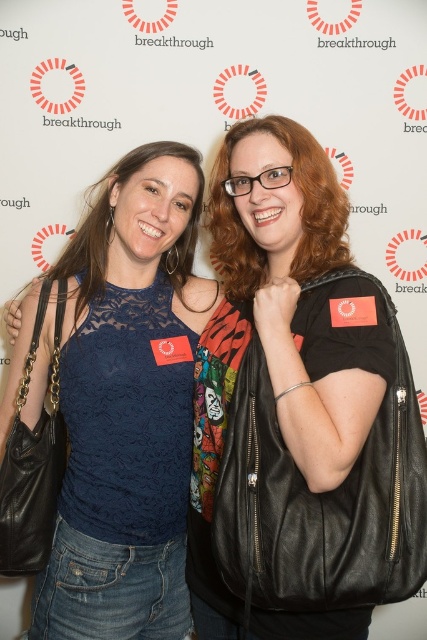
Does lace fabric top at center have a larger size compared to black leather jacket at center?

Actually, lace fabric top at center might be smaller than black leather jacket at center.

Is point (69, 544) closer to viewer compared to point (292, 276)?

No, it is not.

The image size is (427, 640). I want to click on lace fabric top at center, so click(x=125, y=403).